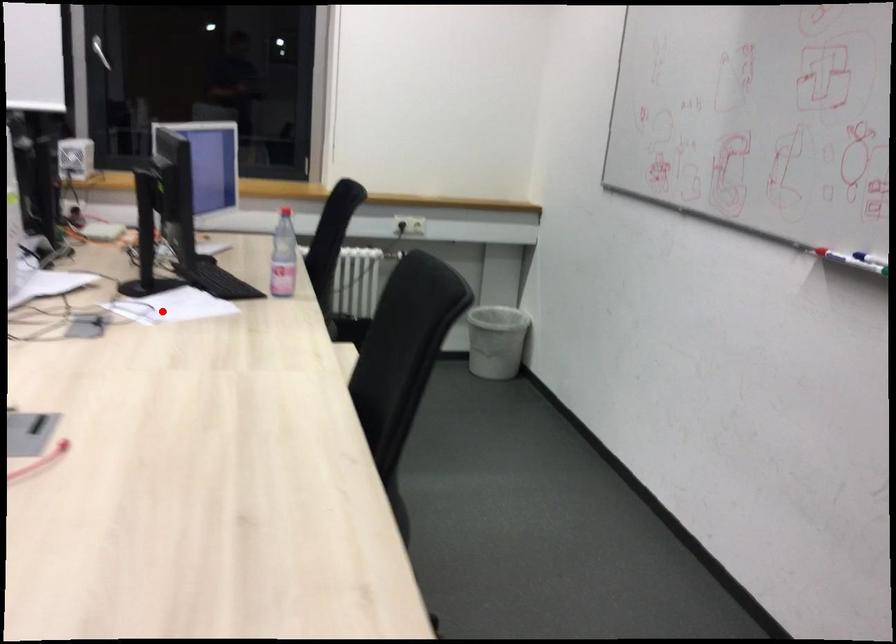
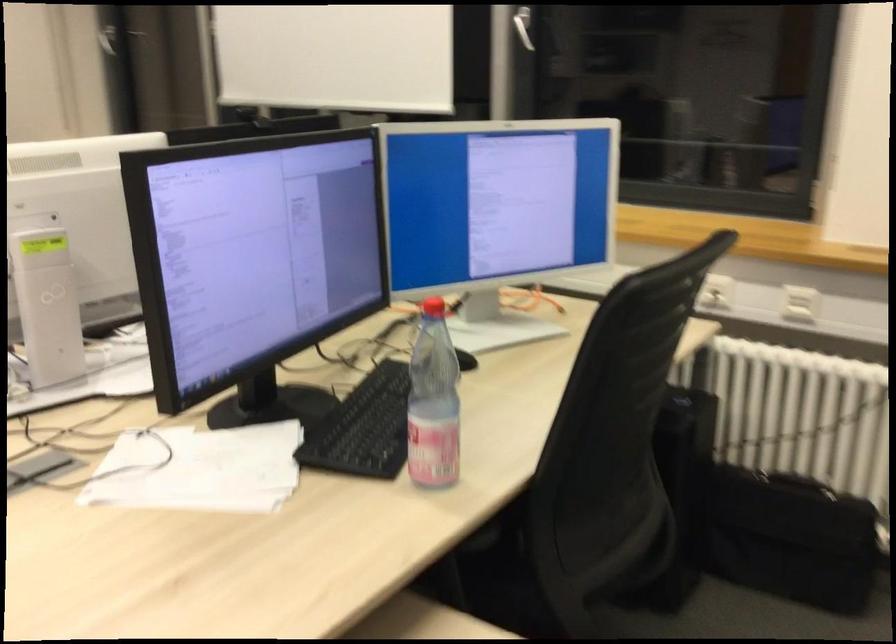
Question: I am providing you with two images of the same scene from different viewpoints. Given a red point in image1, look at the same physical point in image2. Is it:

Choices:
 (A) Closer to the viewpoint
 (B) Farther from the viewpoint

Answer: (A)